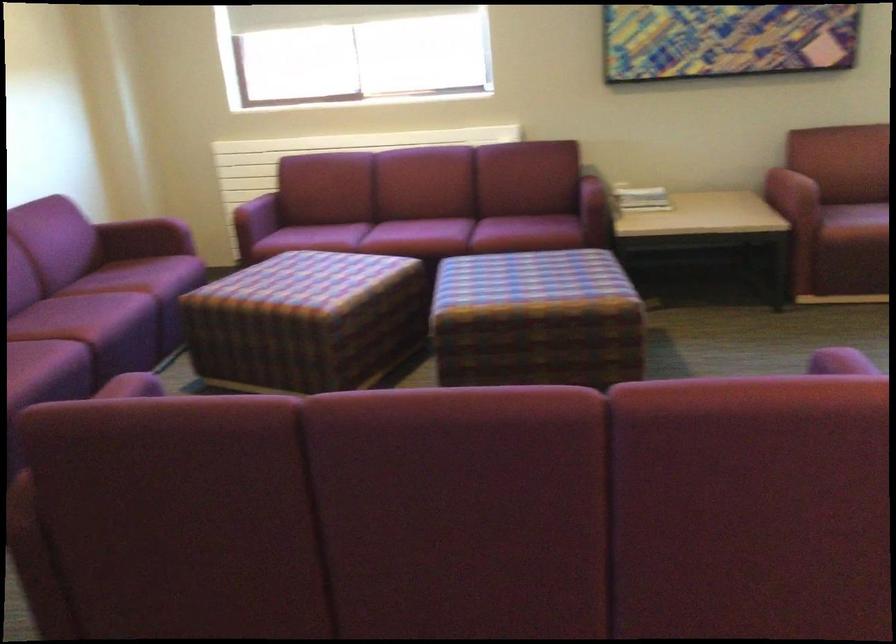
Find where to sit the red chair sitting surface. Please return your answer as a coordinate pair (x, y).

(596, 178)